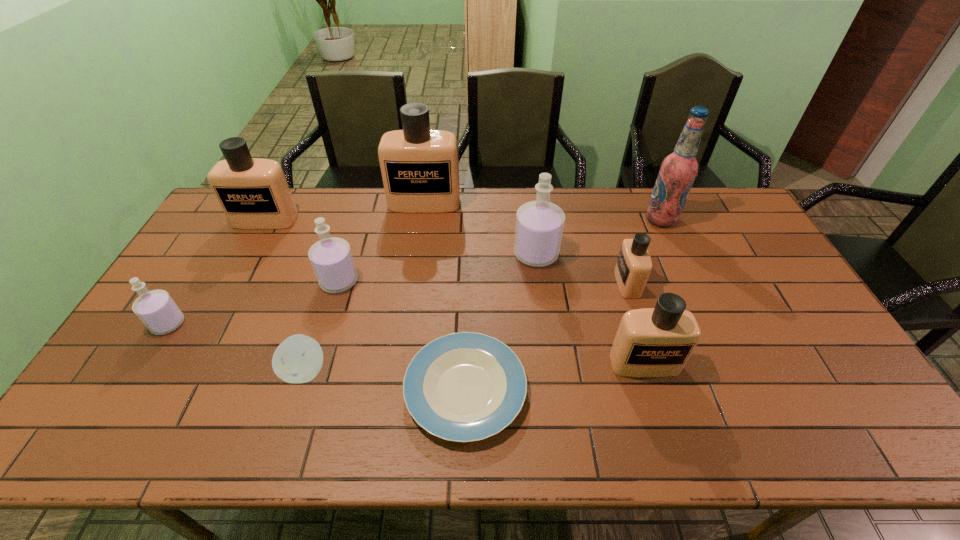
Locate an element on the screen. This screenshot has width=960, height=540. vacant space located on the front label of the second biggest beige perfume is located at coordinates (220, 306).

Where is `free space located 0.300m on the front of the rightmost purple perfume`? free space located 0.300m on the front of the rightmost purple perfume is located at coordinates (548, 349).

Locate an element on the screen. free point located 0.300m on the back of the second purple perfume from right to left is located at coordinates (361, 210).

Identify the location of free location located 0.140m on the front label of the second smallest beige perfume. (664, 431).

This screenshot has height=540, width=960. What are the coordinates of `vacant space located 0.100m on the front label of the third farthest beige perfume` in the screenshot? It's located at (584, 283).

This screenshot has height=540, width=960. Identify the location of blank area located 0.070m on the front label of the third farthest beige perfume. (593, 283).

Locate an element on the screen. This screenshot has width=960, height=540. vacant space positioned 0.070m on the front label of the third farthest beige perfume is located at coordinates pyautogui.click(x=593, y=283).

Find the location of a particular element. free region located on the back of the fourth nearest object is located at coordinates (221, 239).

The height and width of the screenshot is (540, 960). What are the coordinates of `free space located on the back of the white apple` in the screenshot? It's located at (322, 320).

Locate an element on the screen. The width and height of the screenshot is (960, 540). vacant space located 0.210m on the right of the blue plate is located at coordinates (611, 389).